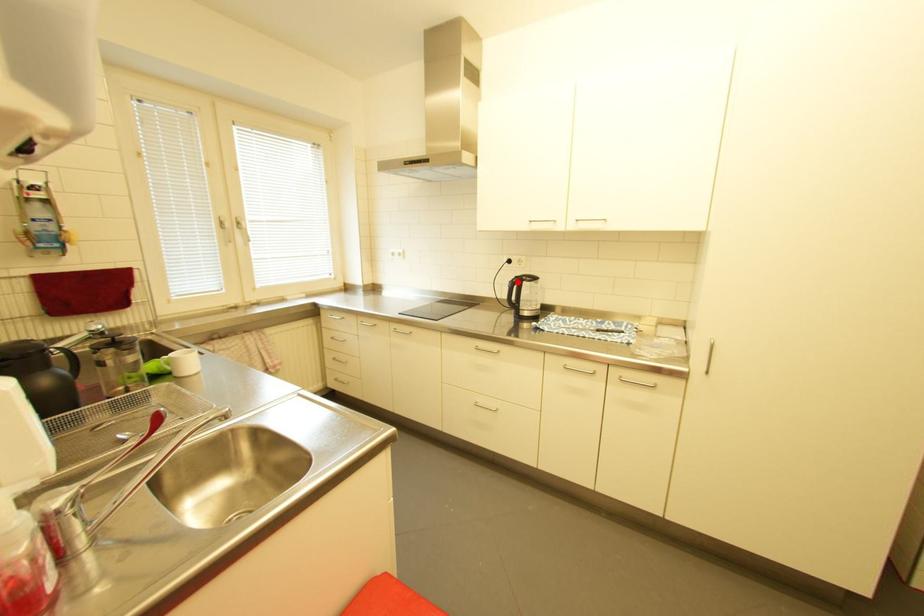
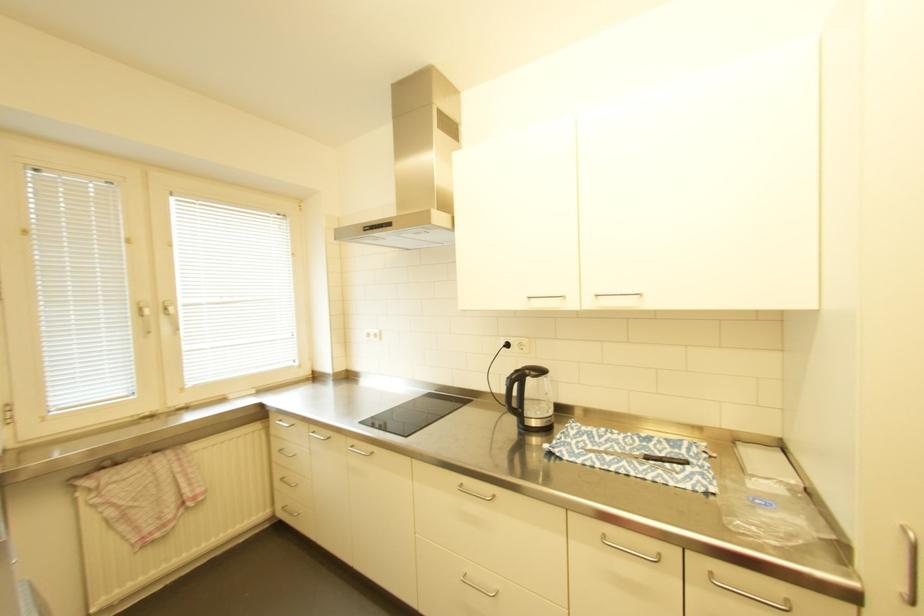
The point at the highlighted location is marked in the first image. Where is the corresponding point in the second image?

(516, 379)